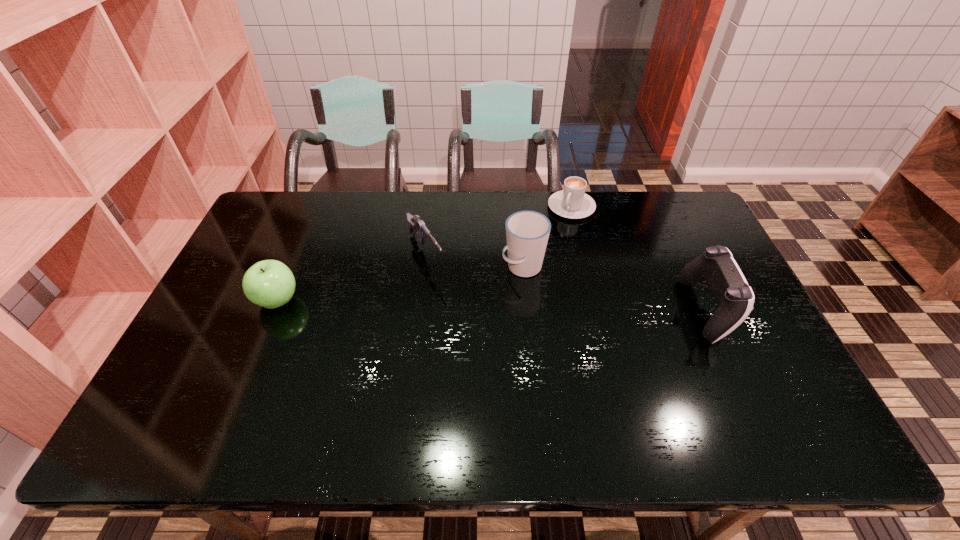
Identify the location of vacant area that lies between the shortest object and the apple. The image size is (960, 540). (424, 254).

Identify the location of vacant point located between the control and the apple. [x=492, y=305].

Image resolution: width=960 pixels, height=540 pixels. Identify the location of vacant area between the apple and the third object from left to right. (400, 284).

Where is `free space between the cup and the apple`? free space between the cup and the apple is located at coordinates (400, 284).

Locate an element on the screen. The image size is (960, 540). unoccupied position between the rightmost object and the second object from left to right is located at coordinates (565, 282).

You are a GUI agent. You are given a task and a screenshot of the screen. Output one action in this format:
    pyautogui.click(x=<x>, y=<y>)
    Task: Click on the vacant area between the control and the leftmost object
    This screenshot has width=960, height=540.
    Given the screenshot: What is the action you would take?
    pyautogui.click(x=492, y=305)

Where is `object that is the second nearest to the leftmost object`? This screenshot has height=540, width=960. object that is the second nearest to the leftmost object is located at coordinates (527, 232).

Locate an element on the screen. This screenshot has height=540, width=960. the fourth closest object to the third object from right to left is located at coordinates (270, 284).

You are a GUI agent. You are given a task and a screenshot of the screen. Output one action in this format:
    pyautogui.click(x=<x>, y=<y>)
    Task: Click on the vacant space that satisfies the following two spatial constraints: 1. on the back side of the cappuccino; 2. on the left side of the third object from left to right
    This screenshot has height=540, width=960.
    Given the screenshot: What is the action you would take?
    pyautogui.click(x=517, y=207)

The height and width of the screenshot is (540, 960). I want to click on vacant region that satisfies the following two spatial constraints: 1. on the front side of the second object from left to right; 2. on the right side of the third object from right to left, so click(x=424, y=267).